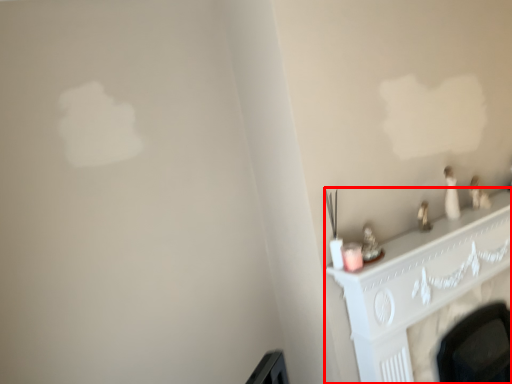
Question: Observing the image, what is the correct spatial positioning of fireplace (annotated by the red box) in reference to candle holder?

Choices:
 (A) right
 (B) left

Answer: (A)